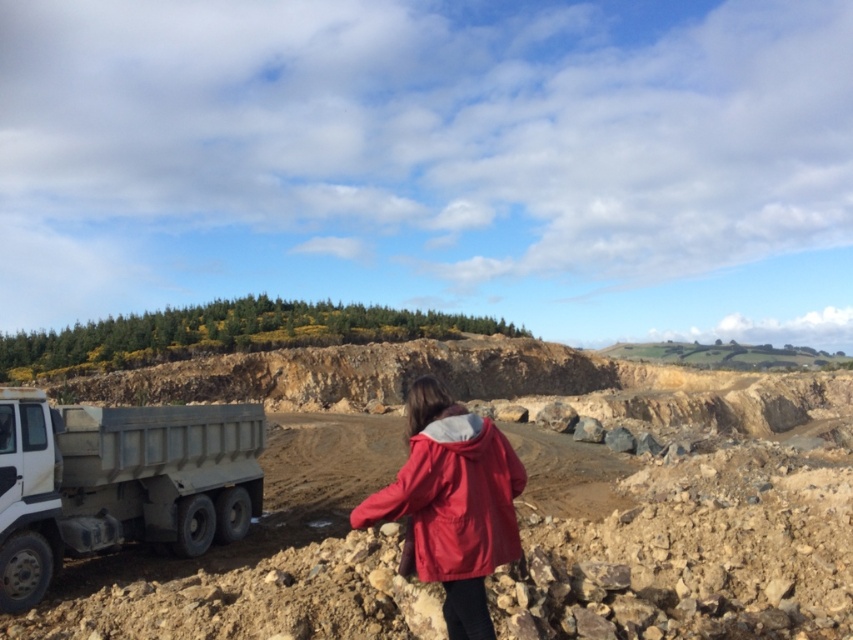
You are a safety inspector at the construction site. You need to ensure that the white metallic truck at lower left is visible from the matte red jacket at center. Is the truck positioned in a way that the person in the red jacket can see it clearly?

The white metallic truck at lower left is below matte red jacket at center, so the person in the matte red jacket at center can see the truck as it is positioned lower in the scene.

You are standing at the point labeled as point (621, 481) in the image. Which object are you currently on?

The point (621, 481) is located on the white metallic truck at lower left.